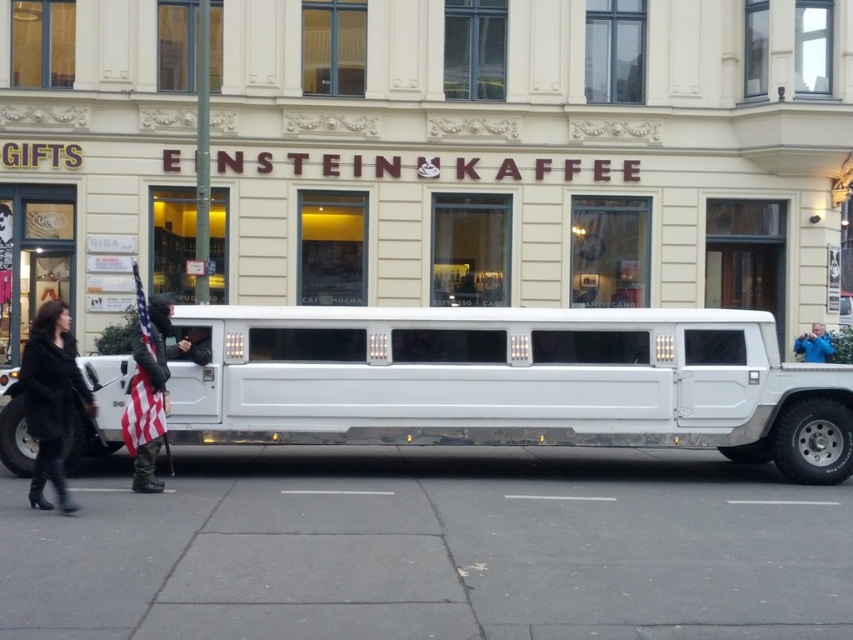
Question: Which of the following is the farthest from the observer?

Choices:
 (A) (151, 467)
 (B) (318, 432)
 (C) (53, 422)

Answer: (B)

Question: Observing the image, what is the correct spatial positioning of white matte limousine at center in reference to blue fabric jacket at center?

Choices:
 (A) below
 (B) above

Answer: (B)

Question: Considering the real-world distances, which object is closest to the gray asphalt pavement at lower center?

Choices:
 (A) american flag fabric at center
 (B) black leather coat at lower left

Answer: (B)

Question: Does gray asphalt pavement at lower center have a lesser width compared to black leather coat at lower left?

Choices:
 (A) yes
 (B) no

Answer: (B)

Question: Does white matte limousine at center come behind american flag fabric at center?

Choices:
 (A) yes
 (B) no

Answer: (A)

Question: Which point is closer to the camera taking this photo?

Choices:
 (A) (602, 561)
 (B) (776, 392)
 (C) (817, 326)
 (D) (144, 456)

Answer: (A)